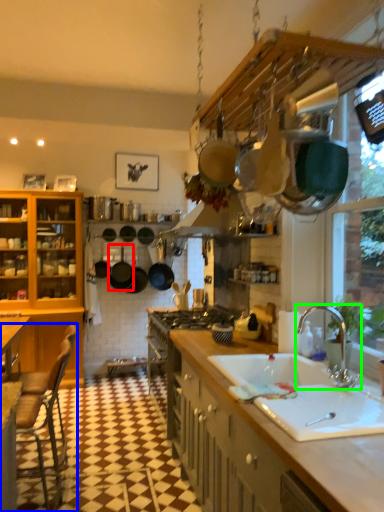
Question: Which is nearer to the frying pan (highlighted by a red box)? chair (highlighted by a blue box) or tap (highlighted by a green box).

Choices:
 (A) chair
 (B) tap

Answer: (A)